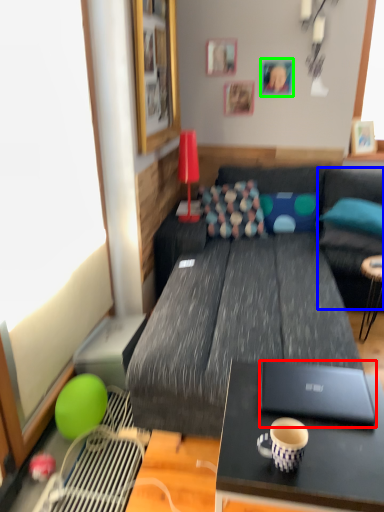
Question: Which object is positioned farthest from laptop (highlighted by a red box)? Select from bean bag chair (highlighted by a blue box) and picture frame (highlighted by a green box).

Choices:
 (A) bean bag chair
 (B) picture frame

Answer: (B)